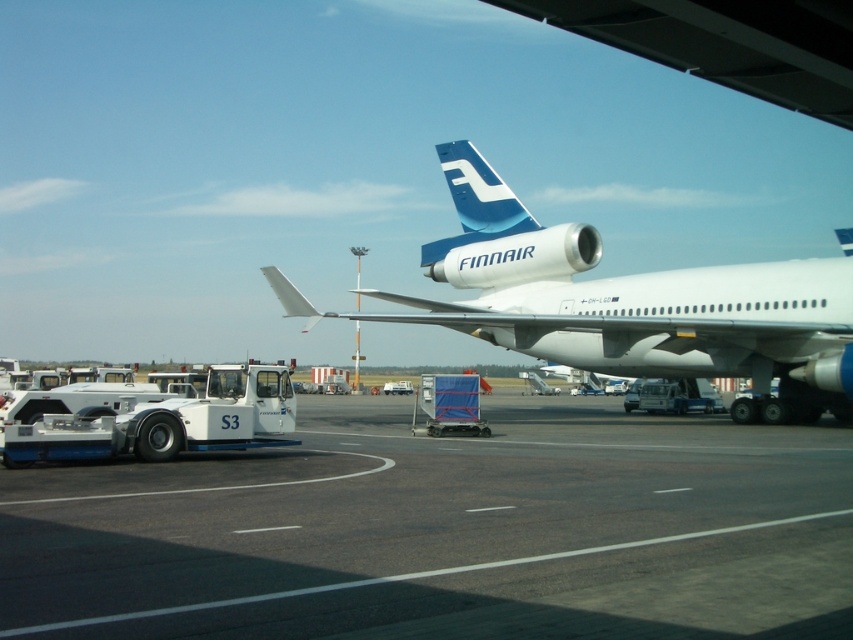
Is white glossy airplane at center closer to the viewer compared to blue glossy finnair tail at upper center?

Yes, it is.

Can you confirm if white glossy airplane at center is thinner than blue glossy finnair tail at upper center?

In fact, white glossy airplane at center might be wider than blue glossy finnair tail at upper center.

Locate an element on the screen. This screenshot has width=853, height=640. white glossy airplane at center is located at coordinates (628, 304).

The width and height of the screenshot is (853, 640). I want to click on black asphalt tarmac at center, so click(445, 531).

Who is positioned more to the left, black asphalt tarmac at center or blue glossy finnair tail at upper center?

blue glossy finnair tail at upper center

Between point (387, 621) and point (466, 193), which one is positioned in front?

Point (387, 621)

Find the location of a particular element. This screenshot has width=853, height=640. black asphalt tarmac at center is located at coordinates (445, 531).

Is point (657, 531) behind point (697, 340)?

No, (657, 531) is closer to viewer.

Is point (682, 506) positioned in front of point (837, 284)?

Yes, it is.

The width and height of the screenshot is (853, 640). Find the location of `black asphalt tarmac at center`. black asphalt tarmac at center is located at coordinates (445, 531).